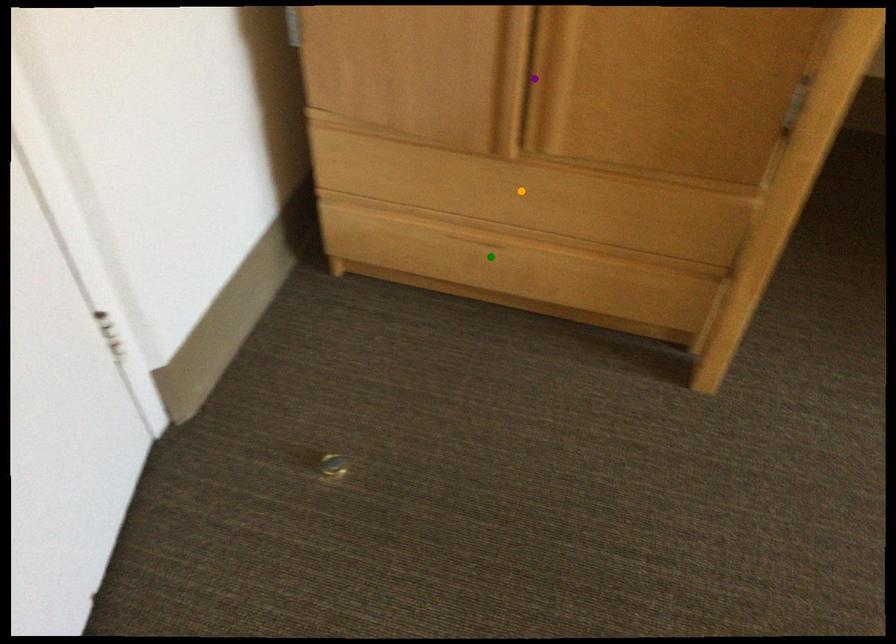
Order these from nearest to farthest:
orange point | green point | purple point

purple point, orange point, green point